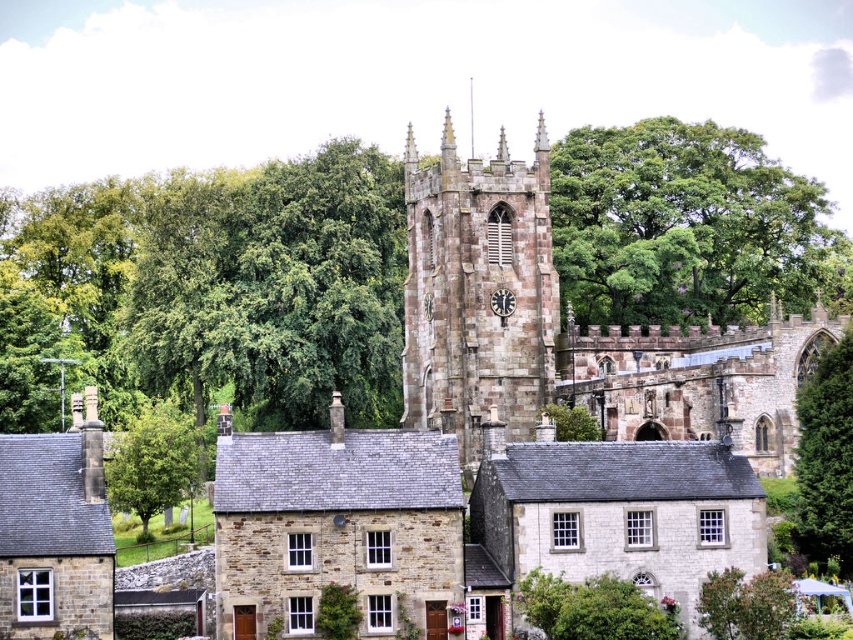
You are an architect visiting the church and want to take a photo of both the rustic stone church at center and the stone clock tower at center. Which one should you focus on first if you want to capture their full structures in a single frame?

You should focus on the rustic stone church at center first because it is larger than the stone clock tower at center, so capturing its full structure might require adjusting the camera angle or zoom level appropriately.

Consider the image. You are a delivery person trying to park your van that is 10 meters wide. You see the rustic stone church at center and the metallic clock at center in the image. Can you estimate if the space between these two objects is wide enough for your van?

The rustic stone church at center might be wider than the metallic clock at center, but without exact measurements of the space between them, it is uncertain if the van will fit. Please check the actual distance before deciding.